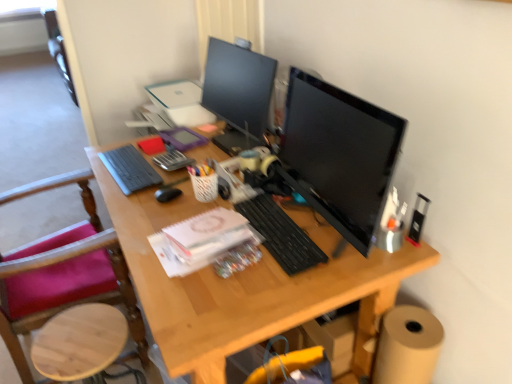
In order to face wooden chair at left, should I rotate leftwards or rightwards?

To align with it, rotate left about 26.255°.

What do you see at coordinates (281, 235) in the screenshot? This screenshot has height=384, width=512. I see `black matte keyboard at center, arranged as the second computer keyboard when viewed from the left` at bounding box center [281, 235].

In order to click on translucent plastic pen holder at center, acting as the first stationery starting from the top in this screenshot , I will do `click(172, 160)`.

In the scene shown: What is the approximate height of metallic black stapler at right, which appears as the second stationery when viewed from the top?

15.56 centimeters.

Find the location of a particular element. The image size is (512, 384). wooden chair at left is located at coordinates (64, 274).

The width and height of the screenshot is (512, 384). I want to click on computer keyboard that is the 2nd one below the matte black monitor at upper center, which is the first computer monitor in back-to-front order (from a real-world perspective), so click(281, 235).

Considering the points (229, 45) and (257, 212), which point is behind, point (229, 45) or point (257, 212)?

Positioned behind is point (229, 45).

Can you confirm if matte black monitor at upper center, which is the first computer monitor in back-to-front order, is positioned to the right of black matte keyboard at center, the first computer keyboard positioned from the right?

In fact, matte black monitor at upper center, which is the first computer monitor in back-to-front order, is to the left of black matte keyboard at center, the first computer keyboard positioned from the right.

Does matte black monitor at upper center, which is the first computer monitor in back-to-front order, have a larger size compared to black matte keyboard at center, the 1th computer keyboard from the front?

Indeed, matte black monitor at upper center, which is the first computer monitor in back-to-front order, has a larger size compared to black matte keyboard at center, the 1th computer keyboard from the front.

Locate an element on the screen. This screenshot has width=512, height=384. stationery above the matte black computer tower at center (from the image's perspective) is located at coordinates (172, 160).

Does translucent plastic pen holder at center, the 2th stationery positioned from the right, have a larger size compared to matte black computer tower at center?

Yes, translucent plastic pen holder at center, the 2th stationery positioned from the right, is bigger than matte black computer tower at center.

From a real-world perspective, is translucent plastic pen holder at center, which ranks as the 1th stationery in back-to-front order, beneath matte black computer tower at center?

Yes, from a real-world perspective, translucent plastic pen holder at center, which ranks as the 1th stationery in back-to-front order, is below matte black computer tower at center.

Which is in front, point (84, 195) or point (364, 132)?

Positioned in front is point (364, 132).

From the image's perspective, which is above, wooden chair at left or black glossy monitor at center, the 2th computer monitor positioned from the back?

black glossy monitor at center, the 2th computer monitor positioned from the back.

Based on their sizes in the image, would you say wooden chair at left is bigger or smaller than black glossy monitor at center, the 2th computer monitor positioned from the back?

Considering their sizes, wooden chair at left takes up more space than black glossy monitor at center, the 2th computer monitor positioned from the back.

From the image's perspective, is gray matte keyboard at left, arranged as the second computer keyboard when ordered from the bottom, located above or below metallic black stapler at right, which appears as the second stationery when viewed from the top?

Based on their image positions, gray matte keyboard at left, arranged as the second computer keyboard when ordered from the bottom, is located above metallic black stapler at right, which appears as the second stationery when viewed from the top.

How different are the orientations of gray matte keyboard at left, marked as the first computer keyboard in a left-to-right arrangement, and metallic black stapler at right, arranged as the first stationery when viewed from the right, in degrees?

gray matte keyboard at left, marked as the first computer keyboard in a left-to-right arrangement, and metallic black stapler at right, arranged as the first stationery when viewed from the right, are facing 9.3 degrees away from each other.

Are gray matte keyboard at left, arranged as the 2th computer keyboard when viewed from the right, and metallic black stapler at right, which appears as the first stationery when viewed from the front, located far from each other?

Indeed, gray matte keyboard at left, arranged as the 2th computer keyboard when viewed from the right, is not near metallic black stapler at right, which appears as the first stationery when viewed from the front.

Which is behind, point (108, 166) or point (410, 230)?

The point (108, 166) is behind.

Could matte black monitor at upper center, which appears as the second computer monitor when viewed from the front, be considered to be inside gray matte keyboard at left, arranged as the 2th computer keyboard when viewed from the right?

That's incorrect, matte black monitor at upper center, which appears as the second computer monitor when viewed from the front, is not inside gray matte keyboard at left, arranged as the 2th computer keyboard when viewed from the right.

Measure the distance from gray matte keyboard at left, arranged as the 2th computer keyboard when viewed from the right, to matte black monitor at upper center, which appears as the second computer monitor when viewed from the front.

The distance of gray matte keyboard at left, arranged as the 2th computer keyboard when viewed from the right, from matte black monitor at upper center, which appears as the second computer monitor when viewed from the front, is 45.59 centimeters.

From a real-world perspective, is gray matte keyboard at left, arranged as the 2th computer keyboard when viewed from the right, positioned over matte black monitor at upper center, which is the first computer monitor in back-to-front order, based on gravity?

No, from a real-world perspective, gray matte keyboard at left, arranged as the 2th computer keyboard when viewed from the right, is not over matte black monitor at upper center, which is the first computer monitor in back-to-front order

From the image's perspective, does gray matte keyboard at left, the second computer keyboard positioned from the front, appear lower than matte black monitor at upper center, which appears as the second computer monitor when viewed from the front?

Yes.

Is black matte keyboard at center, the 1th computer keyboard from the front, next to black glossy monitor at center, which ranks as the first computer monitor in front-to-back order?

black matte keyboard at center, the 1th computer keyboard from the front, and black glossy monitor at center, which ranks as the first computer monitor in front-to-back order, are clearly separated.

Is black matte keyboard at center, the 1th computer keyboard from the front, situated inside black glossy monitor at center, which ranks as the first computer monitor in front-to-back order, or outside?

black matte keyboard at center, the 1th computer keyboard from the front, lies outside black glossy monitor at center, which ranks as the first computer monitor in front-to-back order.

From the image's perspective, relative to black glossy monitor at center, which ranks as the first computer monitor in front-to-back order, is black matte keyboard at center, which is counted as the second computer keyboard, starting from the top, above or below?

Clearly, from the image's perspective, black matte keyboard at center, which is counted as the second computer keyboard, starting from the top, is below black glossy monitor at center, which ranks as the first computer monitor in front-to-back order.

Which of these two, black matte keyboard at center, the 1th computer keyboard from the front, or black glossy monitor at center, which ranks as the first computer monitor in front-to-back order, is smaller?

Smaller between the two is black matte keyboard at center, the 1th computer keyboard from the front.

Considering the positions of point (142, 364) and point (253, 81), is point (142, 364) closer or farther from the camera than point (253, 81)?

Point (142, 364) appears to be farther away from the viewer than point (253, 81).

From the image's perspective, would you say wooden chair at left is shown under matte black monitor at upper center, which is the first computer monitor in back-to-front order?

Yes.

In the scene shown: Is wooden chair at left bigger or smaller than matte black monitor at upper center, which is the first computer monitor in back-to-front order?

In the image, wooden chair at left appears to be larger than matte black monitor at upper center, which is the first computer monitor in back-to-front order.

Find the location of `the 2nd computer keyboard positioned below the matte black monitor at upper center, which is the first computer monitor in back-to-front order (from a real-world perspective)`. the 2nd computer keyboard positioned below the matte black monitor at upper center, which is the first computer monitor in back-to-front order (from a real-world perspective) is located at coordinates (281, 235).

Find the location of a particular element. The height and width of the screenshot is (384, 512). computer tower in front of the translucent plastic pen holder at center, which ranks as the 1th stationery in back-to-front order is located at coordinates (392, 223).

Which object lies further to the anchor point wooden chair at left, metallic black stapler at right, the first stationery positioned from the bottom, or black glossy monitor at center, the 2th computer monitor positioned from the back?

metallic black stapler at right, the first stationery positioned from the bottom, is further to wooden chair at left.

Looking at the image, which one is located further to black glossy monitor at center, which ranks as the first computer monitor in front-to-back order, black matte keyboard at center, which is counted as the second computer keyboard, starting from the top, or black matte mouse at center?

The object further to black glossy monitor at center, which ranks as the first computer monitor in front-to-back order, is black matte mouse at center.

Considering their positions, is wooden chair at left positioned further to wooden at left than matte black computer tower at center?

Among the two, matte black computer tower at center is located further to wooden at left.

Considering their positions, is matte black computer tower at center positioned further to translucent plastic pen holder at center, the second stationery positioned from the bottom, than wooden chair at left?

matte black computer tower at center is positioned further to the anchor translucent plastic pen holder at center, the second stationery positioned from the bottom.

Considering their positions, is matte black monitor at upper center, which is the first computer monitor in back-to-front order, positioned further to wooden at left than black glossy monitor at center, which ranks as the first computer monitor in front-to-back order?

Based on the image, matte black monitor at upper center, which is the first computer monitor in back-to-front order, appears to be further to wooden at left.

Looking at the image, which one is located further to black matte keyboard at center, which ranks as the 1th computer keyboard in bottom-to-top order, black matte mouse at center or matte black computer tower at center?

Based on the image, black matte mouse at center appears to be further to black matte keyboard at center, which ranks as the 1th computer keyboard in bottom-to-top order.

From the picture: Looking at the image, which one is located closer to black matte keyboard at center, the 1th computer keyboard from the front, black glossy monitor at center, the 2th computer monitor positioned from the back, or metallic black stapler at right, acting as the second stationery starting from the back?

The object closer to black matte keyboard at center, the 1th computer keyboard from the front, is black glossy monitor at center, the 2th computer monitor positioned from the back.

Which object lies further to the anchor point metallic black stapler at right, which appears as the second stationery when viewed from the top, gray matte keyboard at left, the second computer keyboard positioned from the front, or black matte keyboard at center, which is the second computer keyboard from back to front?

gray matte keyboard at left, the second computer keyboard positioned from the front, is positioned further to the anchor metallic black stapler at right, which appears as the second stationery when viewed from the top.

The width and height of the screenshot is (512, 384). I want to click on mouse between wooden chair at left and matte black monitor at upper center, which is the first computer monitor in back-to-front order, from left to right, so click(167, 194).

The image size is (512, 384). In order to click on stationery that lies between matte black monitor at upper center, which appears as the second computer monitor when viewed from the front, and black matte mouse at center from top to bottom in this screenshot , I will do `click(172, 160)`.

The height and width of the screenshot is (384, 512). I want to click on mouse that lies between translucent plastic pen holder at center, the 1th stationery positioned from the left, and wooden at left from top to bottom, so click(167, 194).

Find the location of a particular element. computer tower between black matte mouse at center and metallic black stapler at right, acting as the second stationery starting from the back, in the horizontal direction is located at coordinates (392, 223).